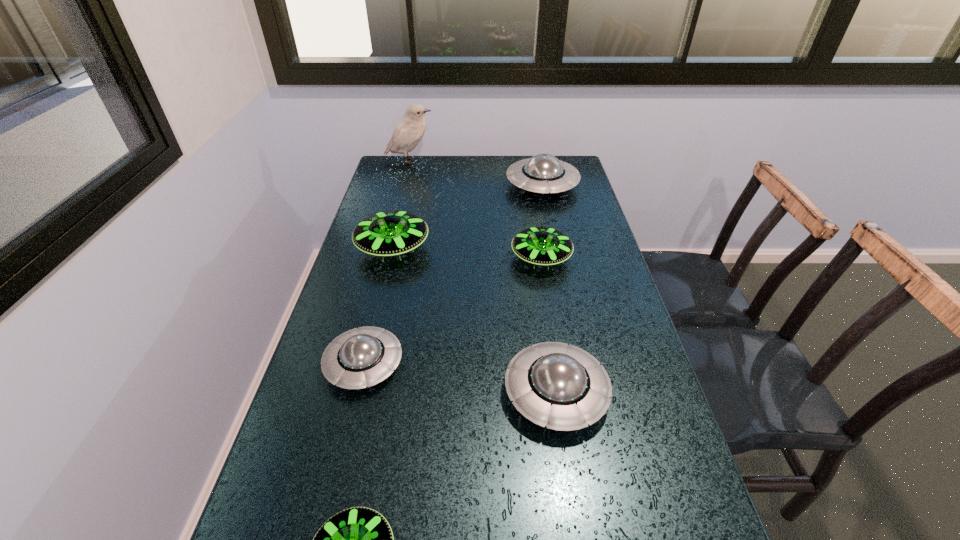
In order to click on white bird in this screenshot , I will do `click(409, 131)`.

Where is `the farthest object`? This screenshot has height=540, width=960. the farthest object is located at coordinates (409, 131).

This screenshot has width=960, height=540. What are the coordinates of `the farthest gray saucer` in the screenshot? It's located at (543, 173).

Identify the location of the farthest saucer. Image resolution: width=960 pixels, height=540 pixels. (543, 173).

The height and width of the screenshot is (540, 960). Identify the location of the biggest green saucer. (390, 233).

Locate an element on the screen. This screenshot has width=960, height=540. the second smallest gray saucer is located at coordinates (553, 384).

You are a GUI agent. You are given a task and a screenshot of the screen. Output one action in this format:
    pyautogui.click(x=<x>, y=<y>)
    Task: Click on the second biggest green saucer
    
    Given the screenshot: What is the action you would take?
    pyautogui.click(x=543, y=246)

The height and width of the screenshot is (540, 960). What are the coordinates of `the smallest gray saucer` in the screenshot? It's located at (366, 356).

Locate an element on the screen. free space located at the beak of the farthest object is located at coordinates (455, 161).

Where is `free point located on the left of the farthest saucer`? This screenshot has height=540, width=960. free point located on the left of the farthest saucer is located at coordinates (418, 185).